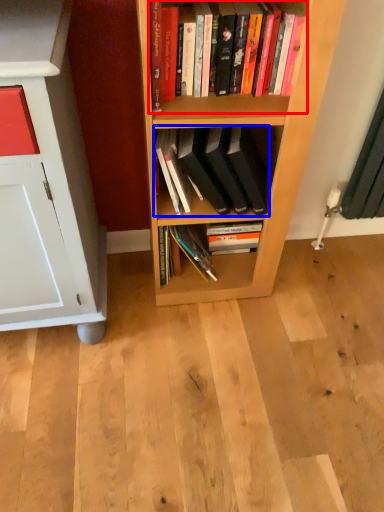
Question: Which object appears closest to the camera in this image, book (highlighted by a red box) or book (highlighted by a blue box)?

Choices:
 (A) book
 (B) book

Answer: (A)